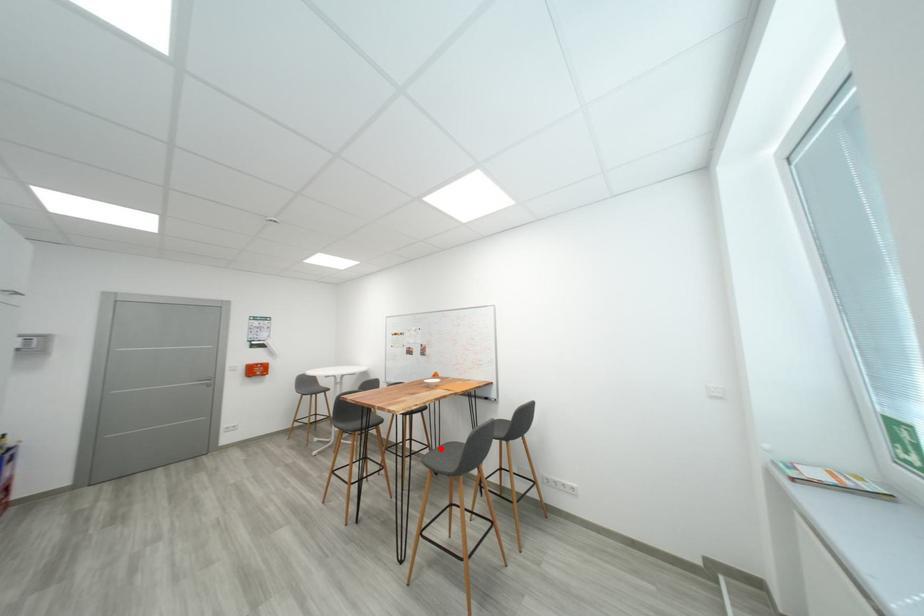
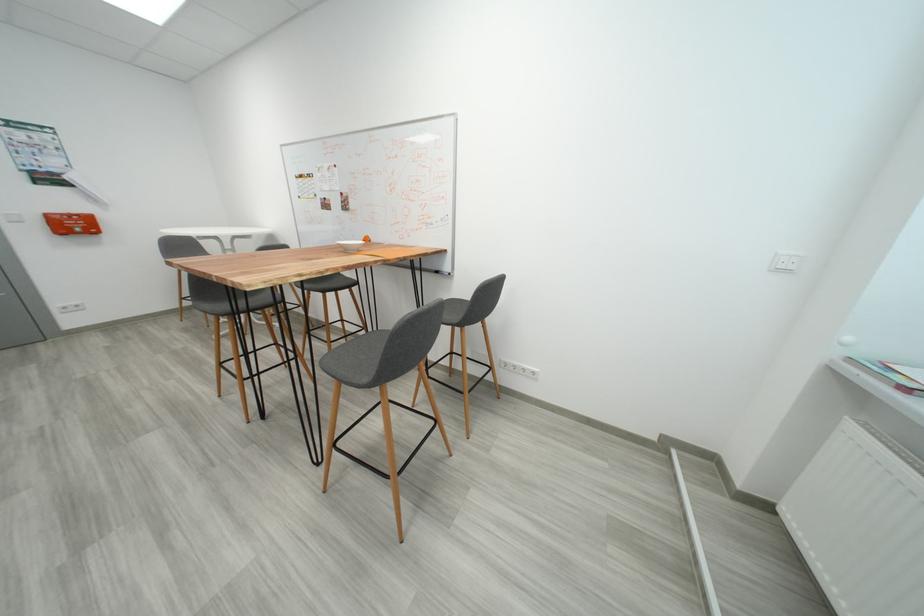
Question: I am providing you with two images of the same scene from different viewpoints. A red point is shown in image1. For the corresponding object point in image2, is it positioned nearer or farther from the camera?

Choices:
 (A) Nearer
 (B) Farther

Answer: (B)